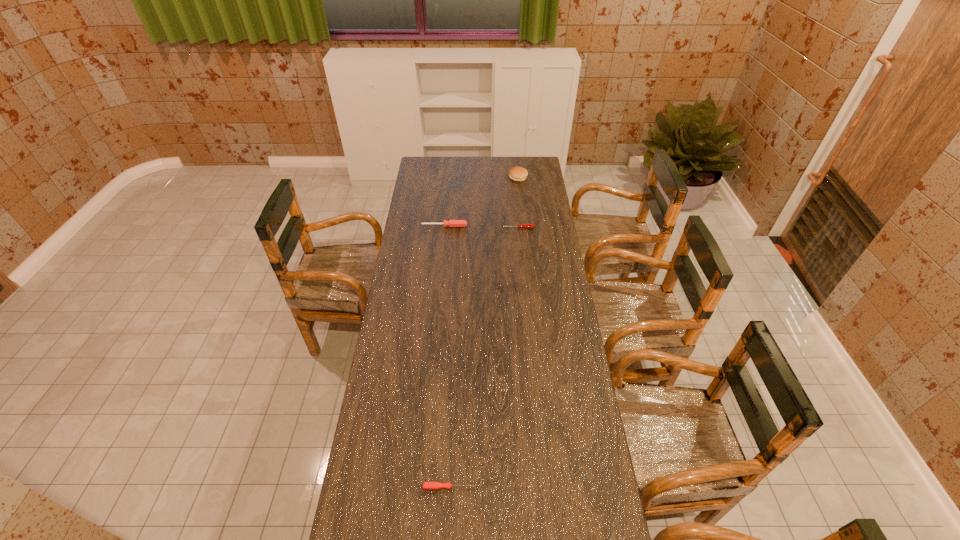
Locate an element on the screen. The width and height of the screenshot is (960, 540). vacant space located at the tip of the shortest object is located at coordinates (552, 487).

Locate an element on the screen. object at the far edge is located at coordinates (516, 173).

The height and width of the screenshot is (540, 960). In order to click on object present at the left edge in this screenshot , I will do `click(451, 223)`.

Locate an element on the screen. The image size is (960, 540). patty that is at the right edge is located at coordinates (516, 173).

Image resolution: width=960 pixels, height=540 pixels. I want to click on screwdriver situated at the right edge, so click(528, 226).

Where is `object situated at the far right corner`? This screenshot has width=960, height=540. object situated at the far right corner is located at coordinates (516, 173).

The width and height of the screenshot is (960, 540). In order to click on vacant space at the far edge of the desktop in this screenshot , I will do `click(511, 158)`.

Locate an element on the screen. This screenshot has height=540, width=960. free space at the left edge of the desktop is located at coordinates (400, 534).

In the image, there is a desktop. Where is `vacant region at the right edge`? vacant region at the right edge is located at coordinates (562, 302).

Find the location of `vacant space at the far left corner of the desktop`. vacant space at the far left corner of the desktop is located at coordinates (418, 174).